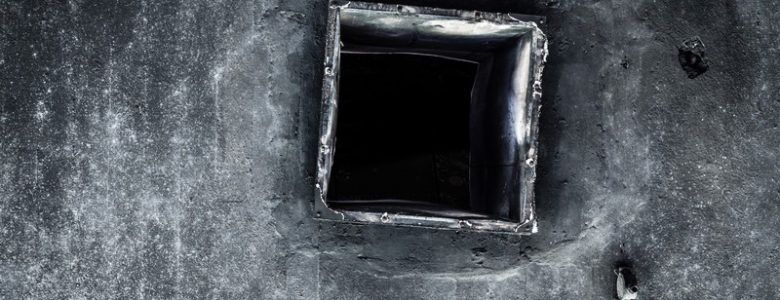
This screenshot has height=300, width=780. I want to click on passageway, so click(395, 132).